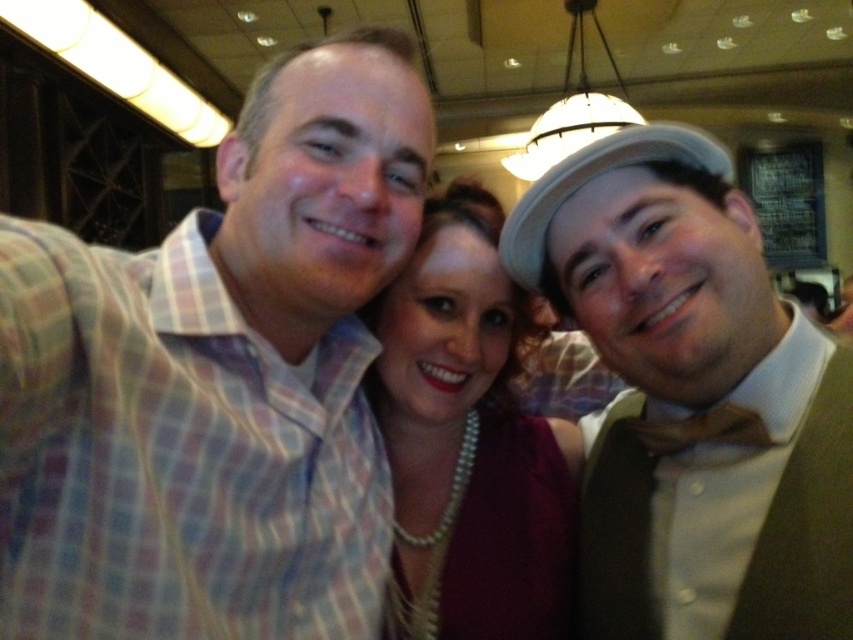
Question: Which object is farther from the camera taking this photo?

Choices:
 (A) pearl necklace at center
 (B) matte brown bow tie at center

Answer: (A)

Question: Does matte brown bow tie at center have a smaller size compared to pearl necklace at center?

Choices:
 (A) yes
 (B) no

Answer: (A)

Question: Which of the following is the farthest from the observer?

Choices:
 (A) (758, 392)
 (B) (421, 401)

Answer: (B)

Question: Which point appears farthest from the camera in this image?

Choices:
 (A) (647, 292)
 (B) (491, 524)

Answer: (B)

Question: Is matte brown bow tie at center bigger than pearl necklace at center?

Choices:
 (A) no
 (B) yes

Answer: (A)

Question: Is matte brown bow tie at center bigger than pearl necklace at center?

Choices:
 (A) no
 (B) yes

Answer: (A)